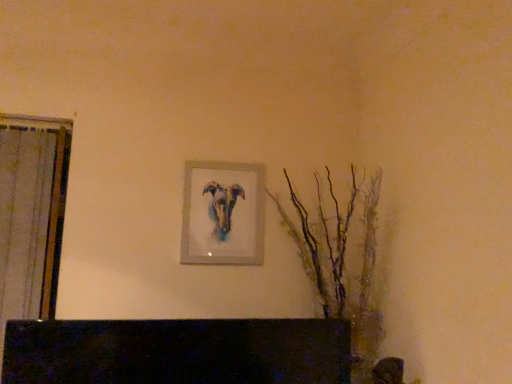
Question: Is matte silver picture frame at center at the right side of translucent glass branches at right?

Choices:
 (A) no
 (B) yes

Answer: (A)

Question: Is matte silver picture frame at center behind translucent glass branches at right?

Choices:
 (A) yes
 (B) no

Answer: (A)

Question: Does matte silver picture frame at center contain translucent glass branches at right?

Choices:
 (A) no
 (B) yes

Answer: (A)

Question: Is the surface of matte silver picture frame at center in direct contact with translucent glass branches at right?

Choices:
 (A) yes
 (B) no

Answer: (B)

Question: From the image's perspective, does matte silver picture frame at center appear higher than translucent glass branches at right?

Choices:
 (A) no
 (B) yes

Answer: (B)

Question: Does matte silver picture frame at center have a greater height compared to translucent glass branches at right?

Choices:
 (A) no
 (B) yes

Answer: (A)

Question: From a real-world perspective, is translucent glass branches at right positioned under matte silver picture frame at center based on gravity?

Choices:
 (A) no
 (B) yes

Answer: (B)

Question: Is there a large distance between translucent glass branches at right and matte silver picture frame at center?

Choices:
 (A) yes
 (B) no

Answer: (B)

Question: From a real-world perspective, is translucent glass branches at right on top of matte silver picture frame at center?

Choices:
 (A) no
 (B) yes

Answer: (A)

Question: Can you confirm if translucent glass branches at right is thinner than matte silver picture frame at center?

Choices:
 (A) no
 (B) yes

Answer: (A)

Question: Is the depth of translucent glass branches at right greater than that of matte silver picture frame at center?

Choices:
 (A) no
 (B) yes

Answer: (A)

Question: Considering the relative sizes of translucent glass branches at right and matte silver picture frame at center in the image provided, is translucent glass branches at right wider than matte silver picture frame at center?

Choices:
 (A) yes
 (B) no

Answer: (A)

Question: Is translucent glass branches at right taller or shorter than matte silver picture frame at center?

Choices:
 (A) tall
 (B) short

Answer: (A)